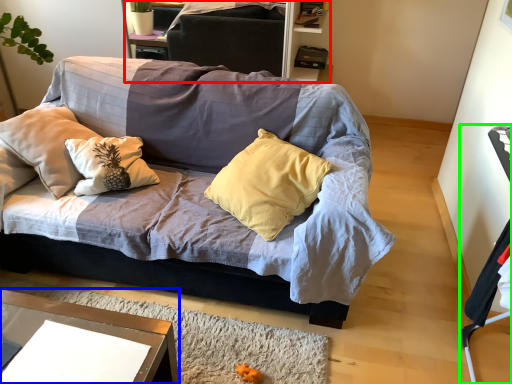
Question: Which is farther away from dresser (highlighted by a red box)? desk (highlighted by a blue box) or armchair (highlighted by a green box)?

Choices:
 (A) desk
 (B) armchair

Answer: (B)